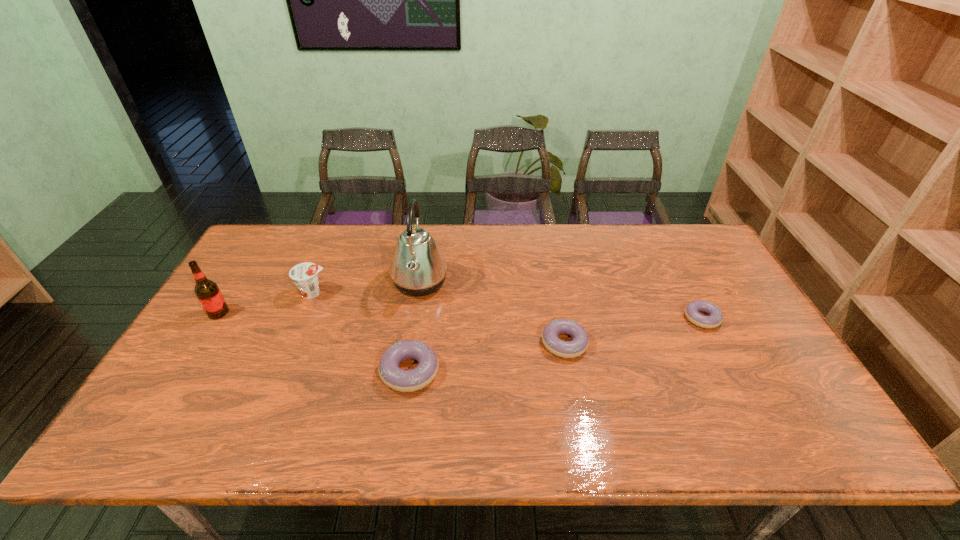
At what (x,y) coordinates should I click in order to perform the action: click on object present at the right edge. Please return your answer as a coordinate pair (x, y). Looking at the image, I should click on (692, 310).

Image resolution: width=960 pixels, height=540 pixels. What are the coordinates of `vacant position at the far edge of the desktop` in the screenshot? It's located at (380, 234).

At what (x,y) coordinates should I click in order to perform the action: click on vacant area at the near edge. Please return your answer as a coordinate pair (x, y). The width and height of the screenshot is (960, 540). Looking at the image, I should click on (672, 385).

Where is `vacant space at the left edge`? vacant space at the left edge is located at coordinates pos(210,328).

Locate an element on the screen. free space at the right edge of the desktop is located at coordinates (724, 319).

Where is `free spot at the near right corner of the desktop`? The height and width of the screenshot is (540, 960). free spot at the near right corner of the desktop is located at coordinates point(802,403).

This screenshot has height=540, width=960. In order to click on vacant space that is in between the fifth object from right to left and the second shortest doughnut in this screenshot , I will do `click(439, 318)`.

I want to click on free area in between the rightmost doughnut and the fourth shortest object, so click(x=507, y=306).

Image resolution: width=960 pixels, height=540 pixels. I want to click on free space between the kettle and the rightmost object, so click(x=561, y=300).

Where is `vacant area between the kettle and the fifth object from left to right`? This screenshot has width=960, height=540. vacant area between the kettle and the fifth object from left to right is located at coordinates (492, 313).